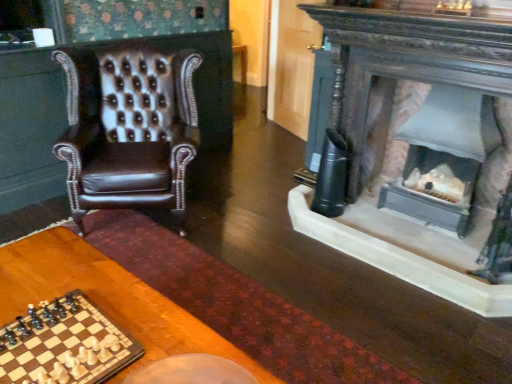
Question: Is wooden table at lower left wider or thinner than wooden chessboard at lower left?

Choices:
 (A) wide
 (B) thin

Answer: (A)

Question: In the image, is wooden table at lower left positioned in front of or behind wooden chessboard at lower left?

Choices:
 (A) front
 (B) behind

Answer: (A)

Question: Which object is the farthest from the brown leather chair at left?

Choices:
 (A) wooden chessboard at lower left
 (B) wooden table at lower left

Answer: (A)

Question: Which of these objects is positioned farthest from the wooden table at lower left?

Choices:
 (A) brown leather chair at left
 (B) wooden chessboard at lower left

Answer: (A)